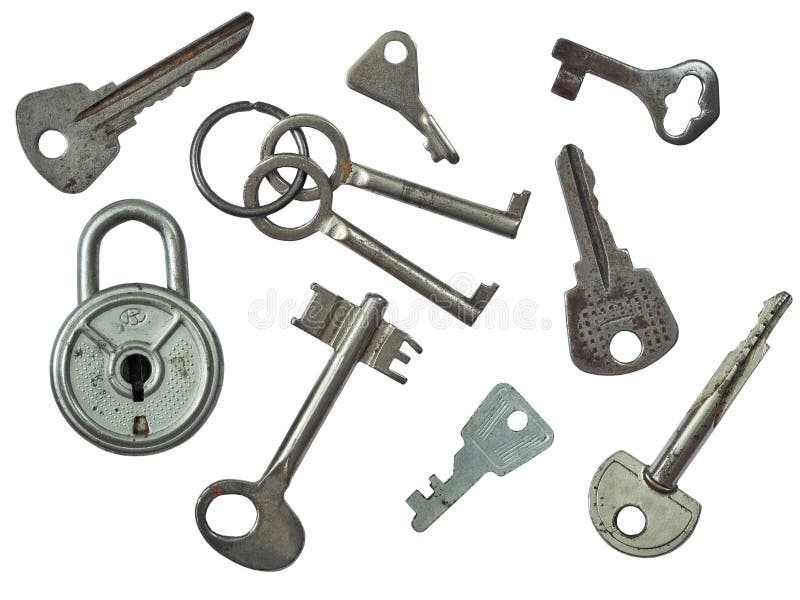
You are a GUI agent. You are given a task and a screenshot of the screen. Output one action in this format:
    pyautogui.click(x=<x>, y=<y>)
    Task: Click on the keys
    This screenshot has width=800, height=600.
    Given the screenshot: What is the action you would take?
    pyautogui.click(x=164, y=76), pyautogui.click(x=382, y=76), pyautogui.click(x=594, y=72), pyautogui.click(x=372, y=184), pyautogui.click(x=334, y=223), pyautogui.click(x=350, y=336), pyautogui.click(x=620, y=334), pyautogui.click(x=509, y=442), pyautogui.click(x=641, y=502)